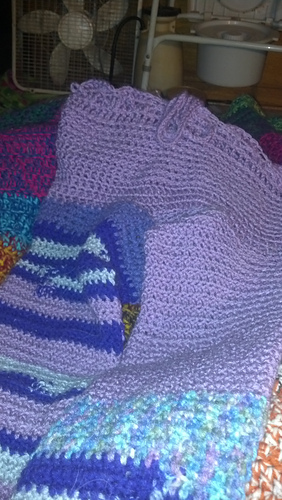
Where is `wooden work surface`? The image size is (282, 500). wooden work surface is located at coordinates (267, 87).